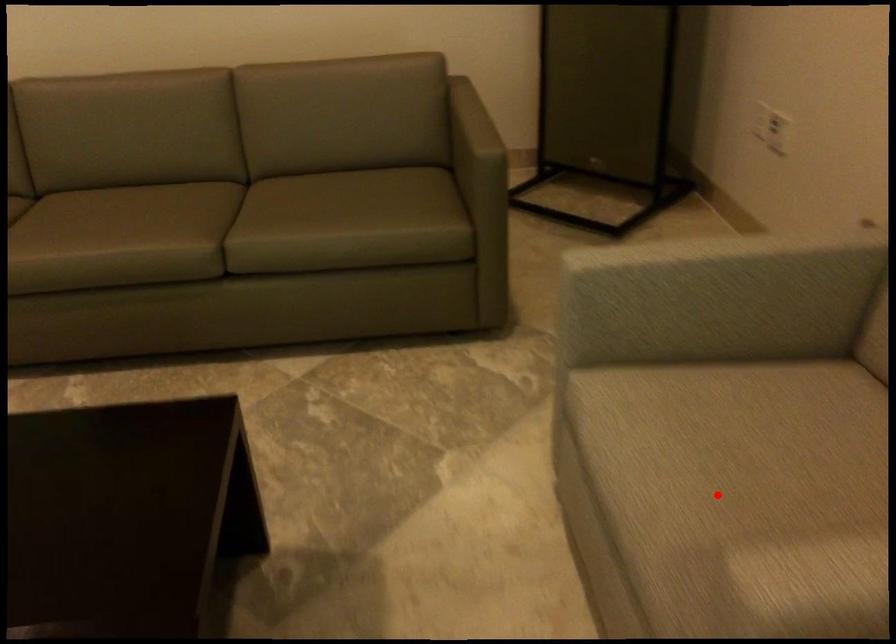
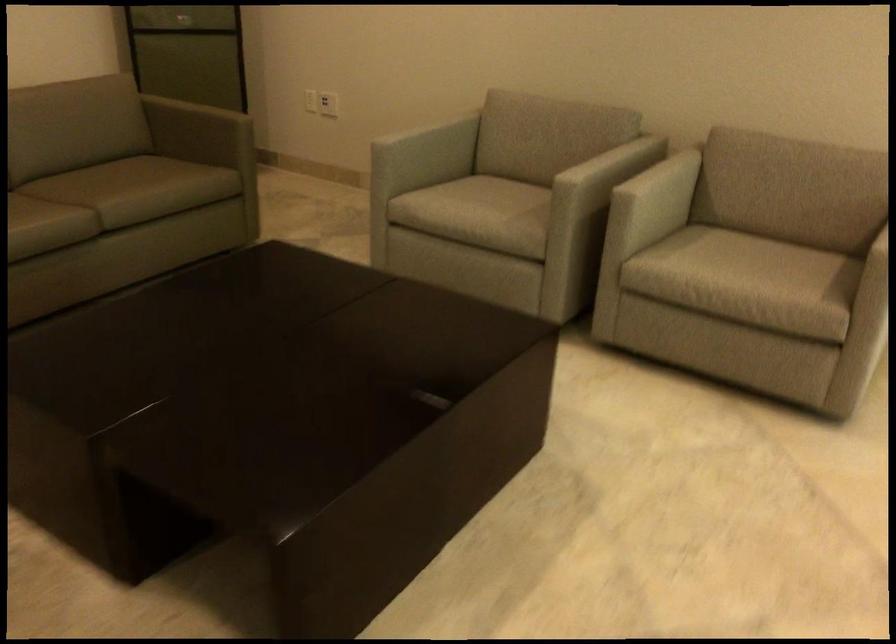
Question: I am providing you with two images of the same scene from different viewpoints. A red point is marked on the first image. Can you still see the location of the red point in image 2?

Choices:
 (A) Yes
 (B) No

Answer: (A)